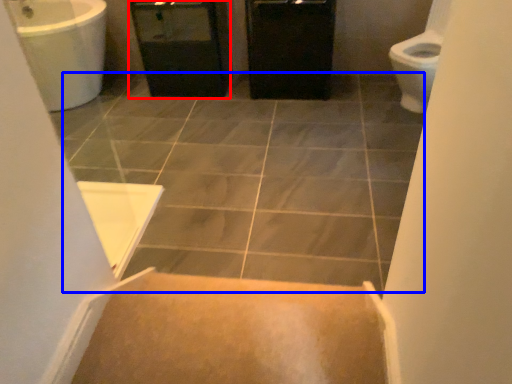
Question: Which object appears closest to the camera in this image, screen door (highlighted by a red box) or ceramic tile (highlighted by a blue box)?

Choices:
 (A) screen door
 (B) ceramic tile

Answer: (B)